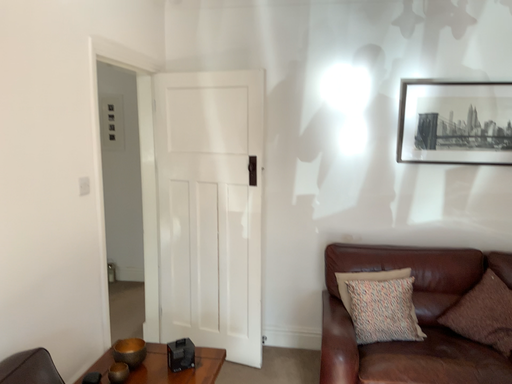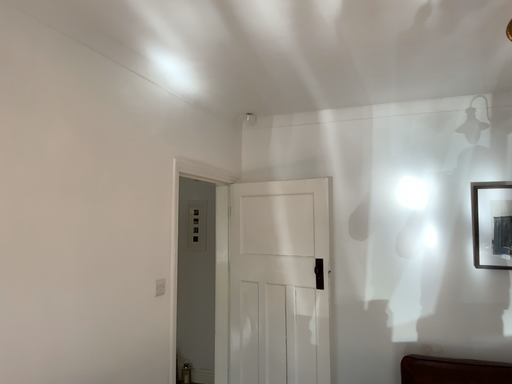
Question: Which way did the camera rotate in the video?

Choices:
 (A) rotated downward
 (B) rotated upward

Answer: (B)